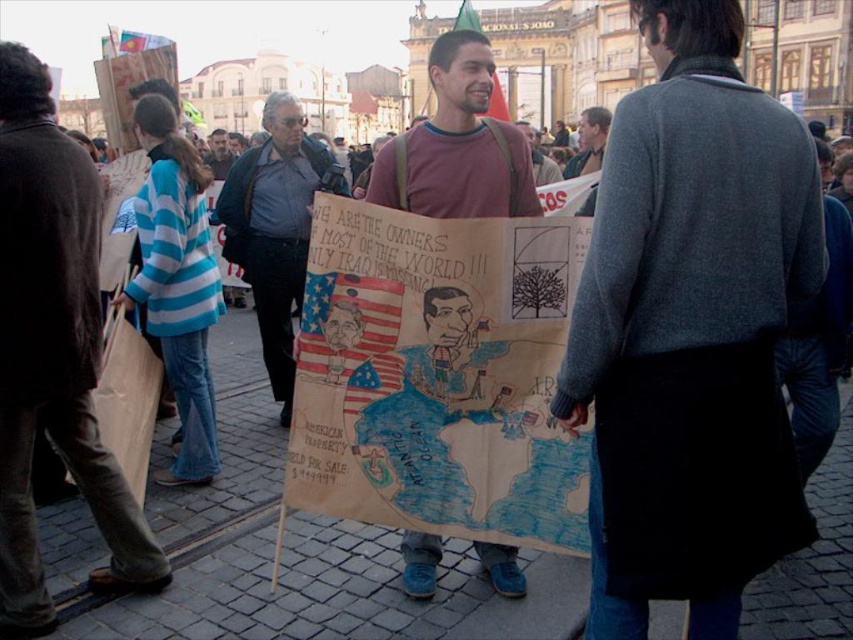
Question: Does gray wool sweater at center have a lesser width compared to matte brown jacket at center?

Choices:
 (A) yes
 (B) no

Answer: (B)

Question: Which of these objects is positioned closest to the matte brown jacket at center?

Choices:
 (A) matte brown poster at center
 (B) matte brown paper sign at center
 (C) gray wool sweater at center

Answer: (A)

Question: Is matte black jacket at center thinner than dark blue jeans at center?

Choices:
 (A) yes
 (B) no

Answer: (A)

Question: Is gray wool sweater at center behind dark blue jeans at center?

Choices:
 (A) no
 (B) yes

Answer: (A)

Question: Which is farther from the dark blue jeans at center?

Choices:
 (A) matte brown jacket at center
 (B) matte brown poster at center
 (C) matte brown paper sign at center

Answer: (C)

Question: Which object appears closest to the camera in this image?

Choices:
 (A) gray wool sweater at center
 (B) matte brown poster at center
 (C) dark blue jeans at center
 (D) matte brown jacket at center

Answer: (A)